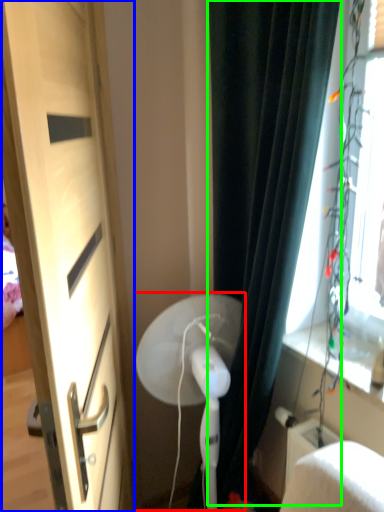
Question: Based on their relative distances, which object is farther from fan (highlighted by a red box)? Choose from door (highlighted by a blue box) and curtain (highlighted by a green box).

Choices:
 (A) door
 (B) curtain

Answer: (A)